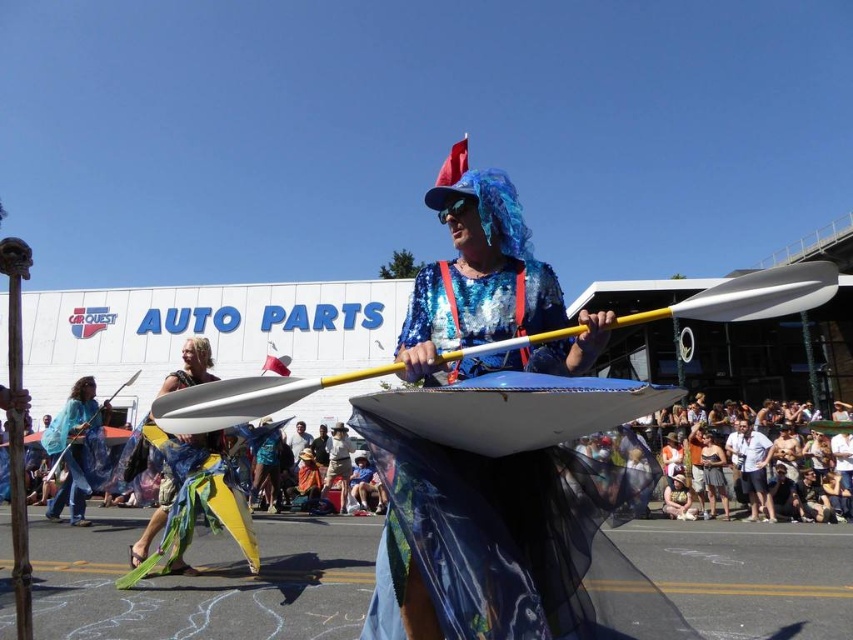
Question: Which point is farther from the camera taking this photo?

Choices:
 (A) (74, 417)
 (B) (151, 410)
 (C) (238, 488)

Answer: (A)

Question: Can you confirm if yellow fabric at center is smaller than matte blue paddle at center?

Choices:
 (A) no
 (B) yes

Answer: (B)

Question: Can you confirm if yellow fabric at center is positioned below matte blue paddle at center?

Choices:
 (A) no
 (B) yes

Answer: (A)

Question: Is yellow fabric at center wider than blue fabric cape at left?

Choices:
 (A) yes
 (B) no

Answer: (B)

Question: Which point is farther from the camera taking this photo?

Choices:
 (A) (73, 436)
 (B) (245, 397)
 (C) (186, 440)
 (D) (79, 444)

Answer: (D)

Question: Which point appears farthest from the camera in this image?

Choices:
 (A) (184, 497)
 (B) (120, 385)

Answer: (B)